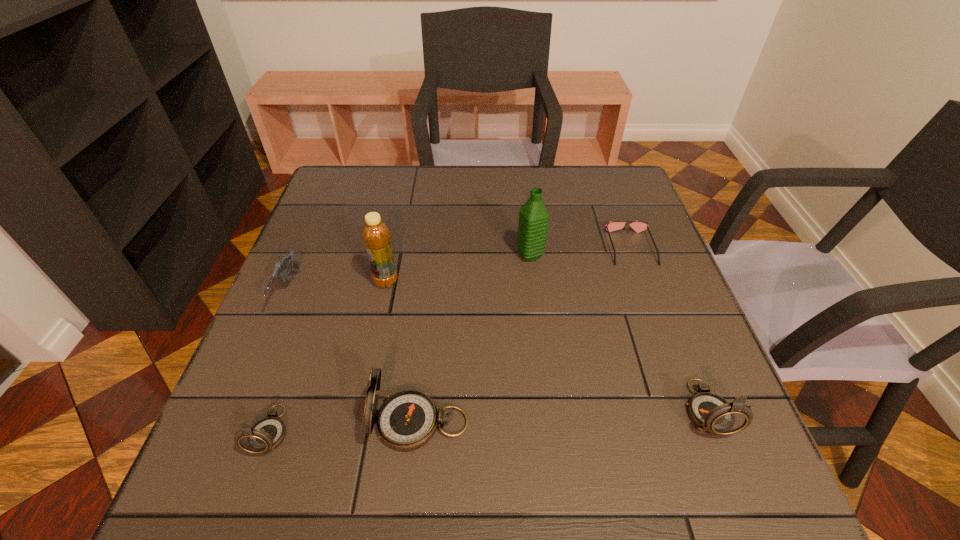
The width and height of the screenshot is (960, 540). I want to click on the third closest object to the third tallest object, so click(x=281, y=268).

At what (x,y) coordinates should I click in order to perform the action: click on the third closest object to the rightmost compass. Please return your answer as a coordinate pair (x, y). This screenshot has height=540, width=960. Looking at the image, I should click on (407, 420).

Choose which compass is the nearest neighbor to the shortest compass. Please provide its 2D coordinates. Your answer should be formatted as a tuple, i.e. [(x, y)], where the tuple contains the x and y coordinates of a point satisfying the conditions above.

[(407, 420)]

At what (x,y) coordinates should I click in order to perform the action: click on compass that stands as the second closest to the bottle. Please return your answer as a coordinate pair (x, y). Image resolution: width=960 pixels, height=540 pixels. Looking at the image, I should click on (265, 435).

At what (x,y) coordinates should I click in order to perform the action: click on free space that satisfies the following two spatial constraints: 1. on the face of the second shortest compass; 2. on the face of the fifth shortest object. Please return your answer as a coordinate pair (x, y). This screenshot has height=540, width=960. Looking at the image, I should click on (712, 423).

The height and width of the screenshot is (540, 960). Find the location of `vacant area in the image that satisfies the following two spatial constraints: 1. on the bridge of the shortest object; 2. on the face of the second compass from left to right`. vacant area in the image that satisfies the following two spatial constraints: 1. on the bridge of the shortest object; 2. on the face of the second compass from left to right is located at coordinates (695, 423).

You are a GUI agent. You are given a task and a screenshot of the screen. Output one action in this format:
    pyautogui.click(x=<x>, y=<y>)
    Task: Click on the free location that satisfies the following two spatial constraints: 1. on the bridge of the shortest object; 2. on the face of the second compass from left to right
    
    Given the screenshot: What is the action you would take?
    (695, 423)